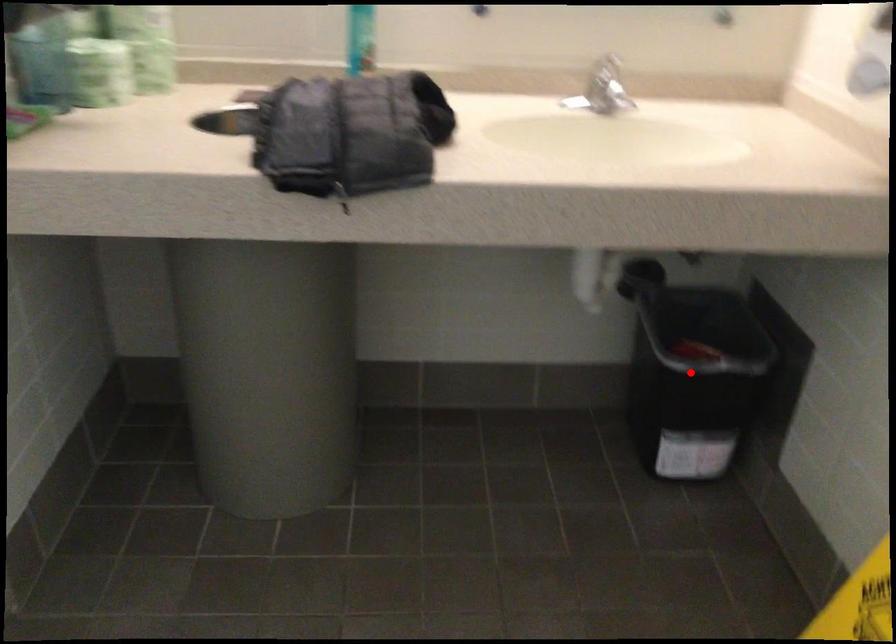
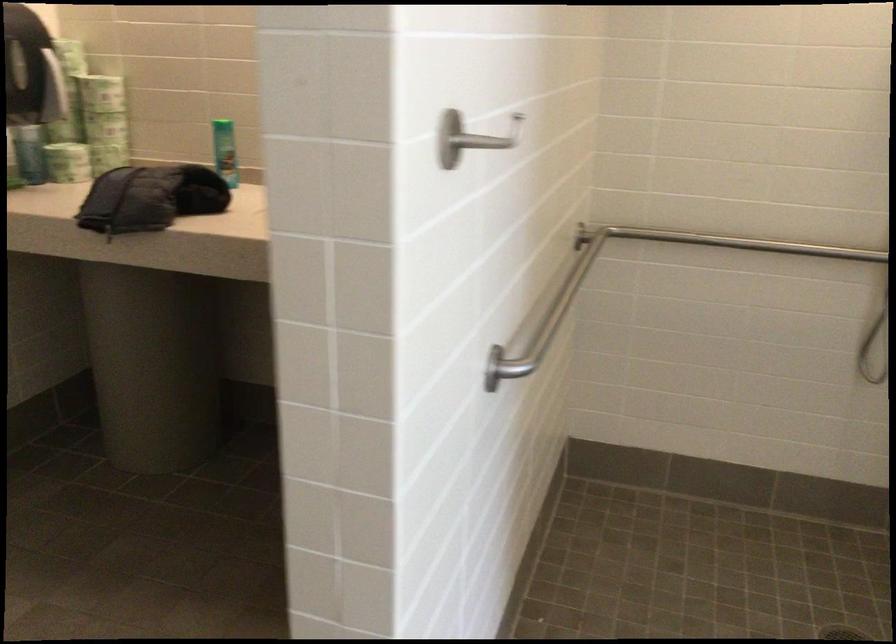
Question: I am providing you with two images of the same scene from different viewpoints. A red point is marked on the first image. Can you still see the location of the red point in image 2?

Choices:
 (A) Yes
 (B) No

Answer: (B)